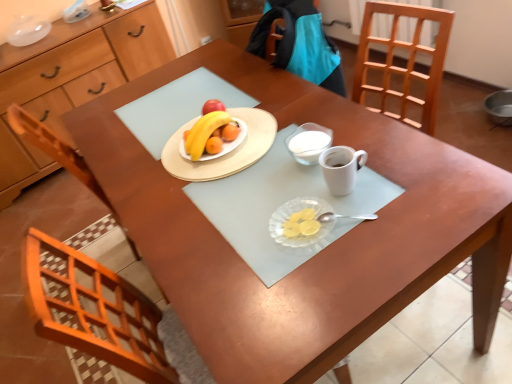
Describe the element at coordinates (228, 153) in the screenshot. I see `matte wooden plate at center` at that location.

Describe the element at coordinates (309, 142) in the screenshot. I see `white glass bowl at center` at that location.

Describe the element at coordinates (294, 212) in the screenshot. I see `transparent glass plate at center` at that location.

I want to click on white matte coffee cup at center, so click(341, 168).

Where is `matte wood cabinet at left`? matte wood cabinet at left is located at coordinates (72, 79).

Could you tell me if white matte coffee cup at center is turned towards yellow matte grapefruit at center?

No, white matte coffee cup at center is not facing towards yellow matte grapefruit at center.

From a real-world perspective, between white matte coffee cup at center and yellow matte grapefruit at center, who is vertically lower?

yellow matte grapefruit at center, from a real-world perspective.

Are white matte coffee cup at center and yellow matte grapefruit at center beside each other?

No, white matte coffee cup at center is not beside yellow matte grapefruit at center.

Is transparent glass plate at center wider or thinner than matte wood cabinet at left?

Clearly, transparent glass plate at center has less width compared to matte wood cabinet at left.

Would you say transparent glass plate at center is a long distance from matte wood cabinet at left?

Yes, transparent glass plate at center is far from matte wood cabinet at left.

From the picture: Which object is positioned more to the right, transparent glass plate at center or matte wood cabinet at left?

Positioned to the right is transparent glass plate at center.

Between transparent glass plate at center and matte wood cabinet at left, which one has smaller size?

Smaller between the two is transparent glass plate at center.

Which object is thinner, transparent glass plate at center or white glass bowl at center?

white glass bowl at center.

From a real-world perspective, between transparent glass plate at center and white glass bowl at center, who is vertically lower?

transparent glass plate at center, from a real-world perspective.

Considering the sizes of objects transparent glass plate at center and white glass bowl at center in the image provided, who is taller, transparent glass plate at center or white glass bowl at center?

With more height is white glass bowl at center.

Is there a large distance between transparent glass plate at center and white glass bowl at center?

No, transparent glass plate at center is not far away from white glass bowl at center.

Is white glass bowl at center oriented away from yellow matte grapefruit at center?

No, white glass bowl at center's orientation is not away from yellow matte grapefruit at center.

What are the coordinates of `grapefruit below the white glass bowl at center (from a real-world perspective)` in the screenshot? It's located at (203, 133).

Who is smaller, white glass bowl at center or yellow matte grapefruit at center?

With smaller size is white glass bowl at center.

Would you say white glass bowl at center is outside yellow matte grapefruit at center?

Yes, white glass bowl at center is not within yellow matte grapefruit at center.

Is point (196, 165) farther from viewer compared to point (20, 172)?

No, it is in front of (20, 172).

From the image's perspective, which is below, matte wooden plate at center or matte wood cabinet at left?

matte wooden plate at center.

The height and width of the screenshot is (384, 512). What are the coordinates of `tableware on the right of matte wood cabinet at left` in the screenshot? It's located at (228, 153).

Considering the relative positions of matte wooden plate at center and matte wood cabinet at left in the image provided, is matte wooden plate at center in front of matte wood cabinet at left?

Yes, matte wooden plate at center is closer to the viewer.

Is matte wood cabinet at left far away from white matte coffee cup at center?

matte wood cabinet at left is far away from white matte coffee cup at center.

Is point (121, 32) behind point (339, 187)?

Yes, point (121, 32) is farther from viewer.

Considering the sizes of objects matte wood cabinet at left and white matte coffee cup at center in the image provided, who is smaller, matte wood cabinet at left or white matte coffee cup at center?

With smaller size is white matte coffee cup at center.

Between matte wood cabinet at left and white matte coffee cup at center, which one is positioned in front?

white matte coffee cup at center is in front.

Is yellow matte grapefruit at center beside transparent glass plate at center?

They are not placed beside each other.

The height and width of the screenshot is (384, 512). I want to click on grapefruit lying above the transparent glass plate at center (from the image's perspective), so click(203, 133).

Would you say yellow matte grapefruit at center contains transparent glass plate at center?

No, transparent glass plate at center is not surrounded by yellow matte grapefruit at center.

Which of these two, yellow matte grapefruit at center or transparent glass plate at center, stands shorter?

With less height is transparent glass plate at center.

The height and width of the screenshot is (384, 512). I want to click on coffee cup located on the right of yellow matte grapefruit at center, so click(341, 168).

The height and width of the screenshot is (384, 512). In order to click on glass plate that is above the matte wood cabinet at left (from a real-world perspective) in this screenshot , I will do `click(294, 212)`.

From the image, which object appears to be farther from white matte coffee cup at center, yellow matte grapefruit at center or transparent glass plate at center?

yellow matte grapefruit at center is further to white matte coffee cup at center.

Which object lies nearer to the anchor point yellow matte grapefruit at center, white matte coffee cup at center or matte wooden plate at center?

matte wooden plate at center.

Looking at the image, which one is located further to white glass bowl at center, matte wooden plate at center or matte wood cabinet at left?

The object further to white glass bowl at center is matte wood cabinet at left.

In the scene shown: Based on their spatial positions, is transparent glass plate at center or white matte coffee cup at center further from white glass bowl at center?

transparent glass plate at center is positioned further to the anchor white glass bowl at center.

Estimate the real-world distances between objects in this image. Which object is further from white matte coffee cup at center, transparent glass plate at center or matte wooden plate at center?

matte wooden plate at center is further to white matte coffee cup at center.

Considering their positions, is matte wood cabinet at left positioned further to yellow matte grapefruit at center than transparent glass plate at center?

matte wood cabinet at left lies further to yellow matte grapefruit at center than the other object.

Considering their positions, is white matte coffee cup at center positioned closer to white glass bowl at center than transparent glass plate at center?

white matte coffee cup at center is closer to white glass bowl at center.

Looking at the image, which one is located further to white matte coffee cup at center, matte wood cabinet at left or yellow matte grapefruit at center?

matte wood cabinet at left is further to white matte coffee cup at center.

Find the location of a particular element. Image resolution: width=512 pixels, height=384 pixels. grapefruit between matte wood cabinet at left and matte wooden plate at center is located at coordinates (203, 133).

Image resolution: width=512 pixels, height=384 pixels. Identify the location of tableware between yellow matte grapefruit at center and white glass bowl at center in the horizontal direction. (228, 153).

At what (x,y) coordinates should I click in order to perform the action: click on tableware between matte wood cabinet at left and transparent glass plate at center. Please return your answer as a coordinate pair (x, y). This screenshot has width=512, height=384. Looking at the image, I should click on (228, 153).

At what (x,y) coordinates should I click in order to perform the action: click on coffee cup between white glass bowl at center and transparent glass plate at center in the vertical direction. Please return your answer as a coordinate pair (x, y). Looking at the image, I should click on (341, 168).